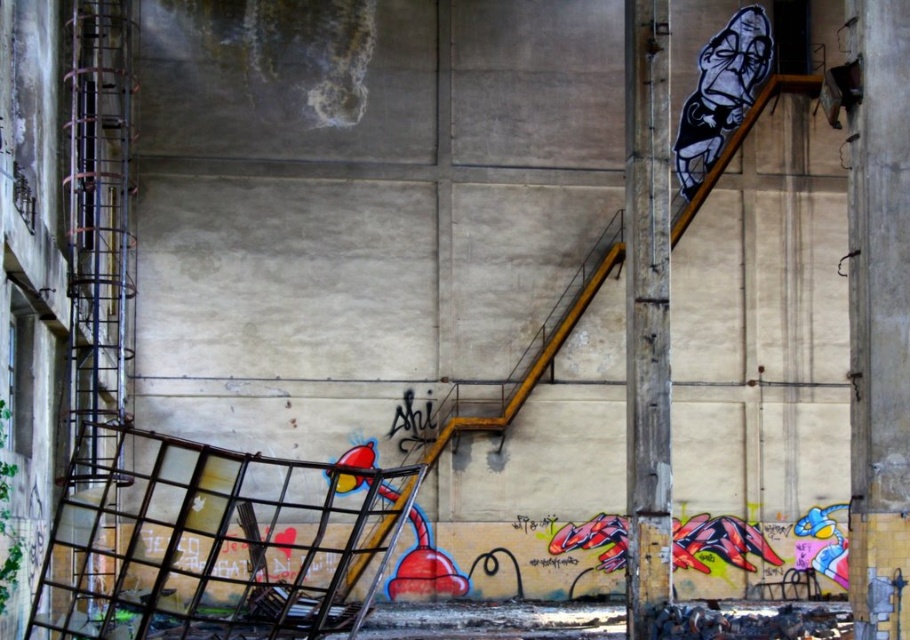
Can you confirm if rusty metal pole at right is positioned to the right of black and white graffiti at upper right?

No, rusty metal pole at right is not to the right of black and white graffiti at upper right.

You are a GUI agent. You are given a task and a screenshot of the screen. Output one action in this format:
    pyautogui.click(x=<x>, y=<y>)
    Task: Click on the rusty metal pole at right
    
    Given the screenshot: What is the action you would take?
    pyautogui.click(x=646, y=308)